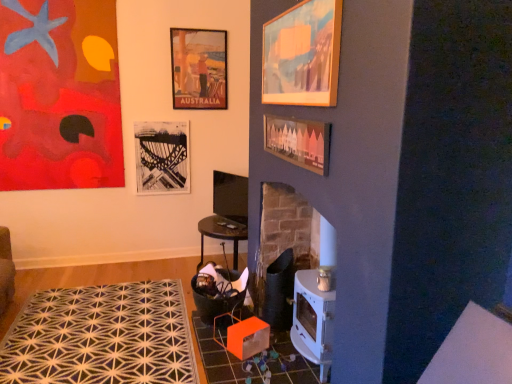
Identify the location of free point above matte paper poster at upper center, which is counted as the 4th picture frame, starting from the front (from a real-world perspective). (206, 20).